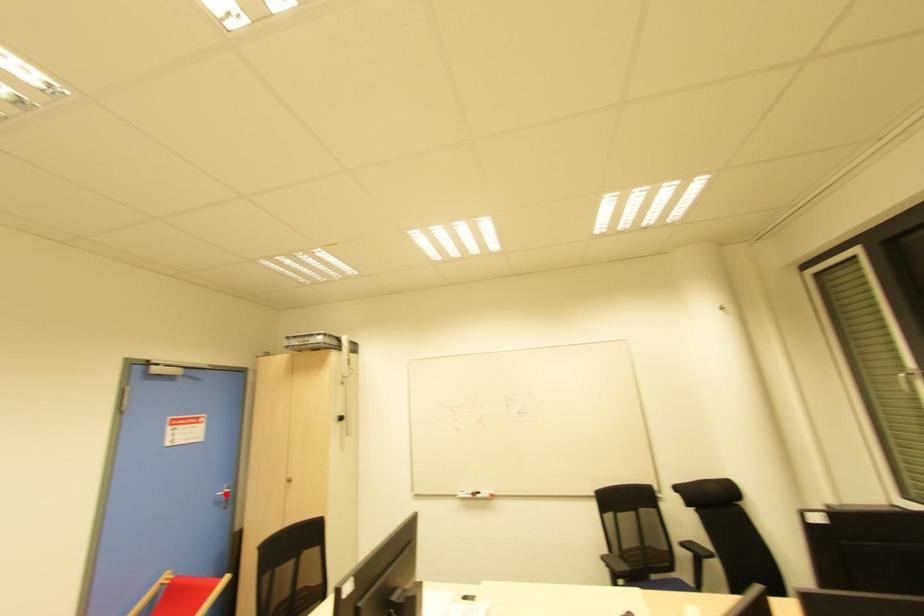
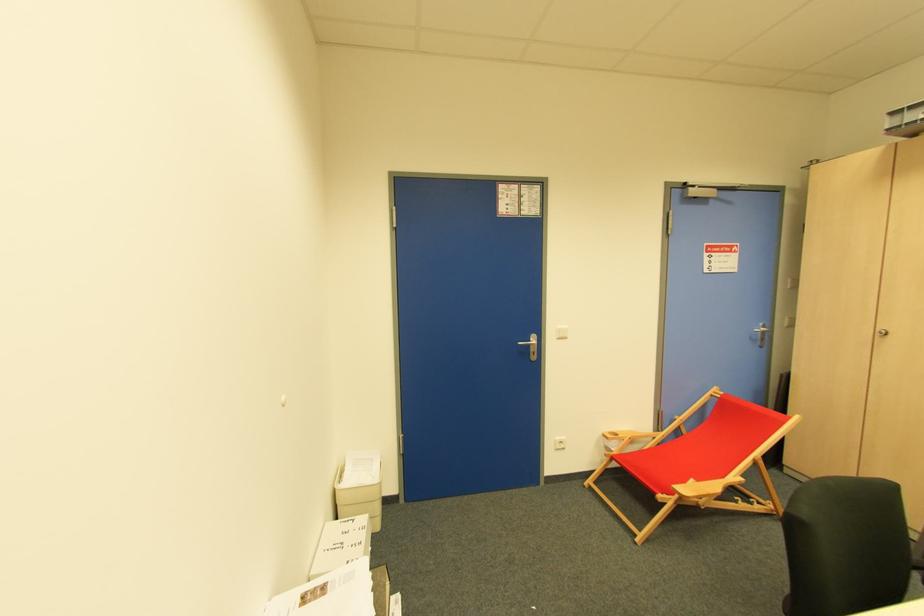
The point at the highlighted location is marked in the first image. Where is the corresponding point in the second image?

(763, 333)